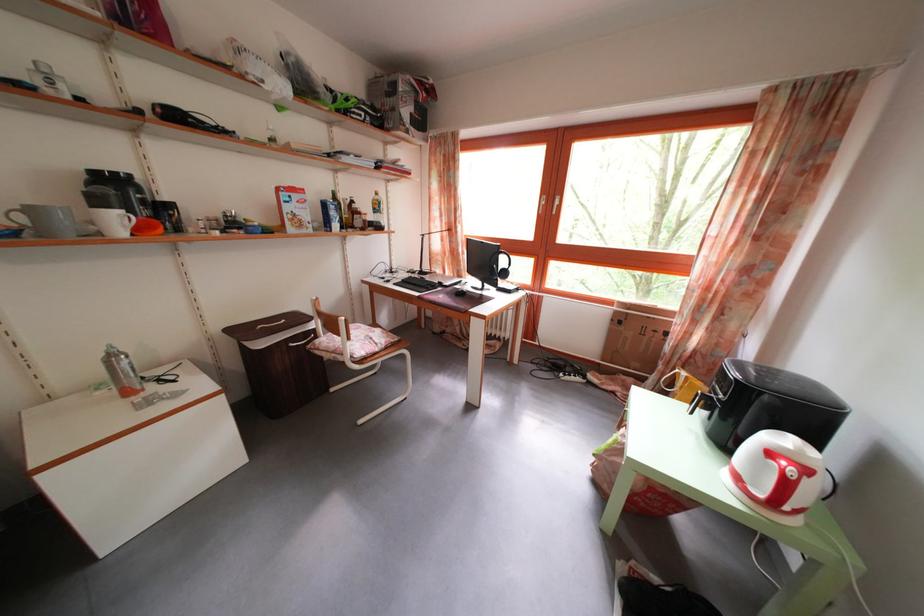
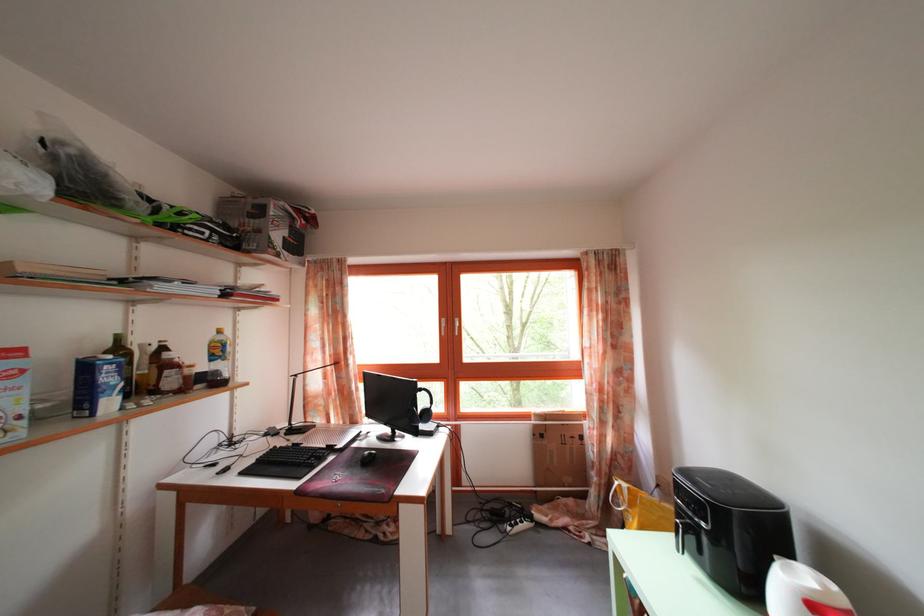
In the second image, find the point that corresponds to (384,215) in the first image.

(225, 359)